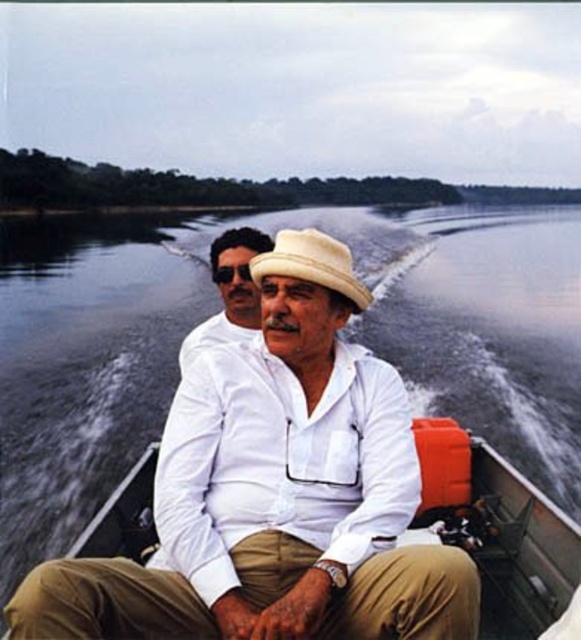
Question: Based on their relative distances, which object is farther from the khaki cotton pants at center?

Choices:
 (A) white cotton shirt at center
 (B) white fabric boat at center
 (C) matte white shirt at center
 (D) white straw hat at center

Answer: (C)

Question: Among these points, which one is nearest to the camera?

Choices:
 (A) (579, 536)
 (B) (328, 289)
 (C) (62, 620)

Answer: (C)

Question: Can you confirm if white cotton shirt at center is positioned to the right of matte white shirt at center?

Choices:
 (A) yes
 (B) no

Answer: (A)

Question: Which object is closer to the camera taking this photo?

Choices:
 (A) matte white shirt at center
 (B) khaki cotton pants at center
 (C) white straw hat at center

Answer: (B)

Question: Does khaki cotton pants at center appear under matte white shirt at center?

Choices:
 (A) yes
 (B) no

Answer: (A)

Question: Is white fabric boat at center bigger than matte white shirt at center?

Choices:
 (A) no
 (B) yes

Answer: (A)